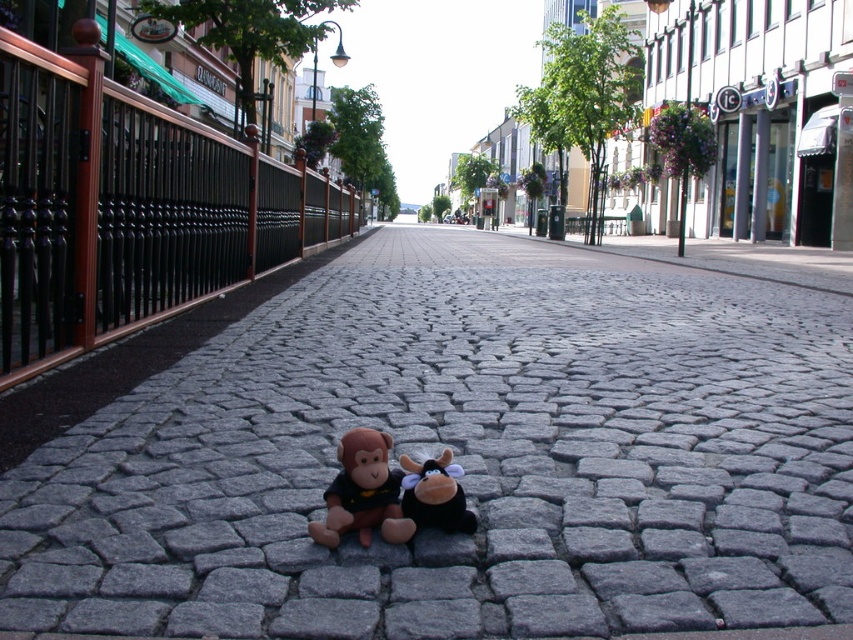
Question: Which point is farther to the camera?

Choices:
 (A) brown plush monkey at center
 (B) gray cobblestone pavement at center
 (C) black plush toy at center

Answer: (B)

Question: Does gray cobblestone pavement at center appear on the left side of black plush toy at center?

Choices:
 (A) yes
 (B) no

Answer: (B)

Question: Does gray cobblestone pavement at center have a larger size compared to black plush toy at center?

Choices:
 (A) yes
 (B) no

Answer: (A)

Question: Based on their relative distances, which object is nearer to the brown plush monkey at center?

Choices:
 (A) black plush toy at center
 (B) gray cobblestone pavement at center

Answer: (A)

Question: Which point is farther to the camera?

Choices:
 (A) tap(335, 504)
 (B) tap(438, 477)
 (C) tap(503, 464)

Answer: (C)

Question: Does gray cobblestone pavement at center have a larger size compared to black plush toy at center?

Choices:
 (A) no
 (B) yes

Answer: (B)